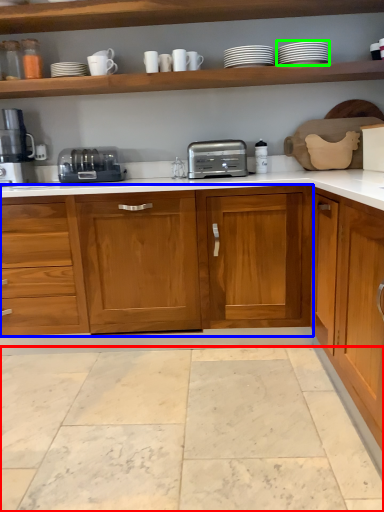
Question: Which object is positioned farthest from granite (highlighted by a red box)? Select from cabinetry (highlighted by a blue box) and tableware (highlighted by a green box).

Choices:
 (A) cabinetry
 (B) tableware

Answer: (B)